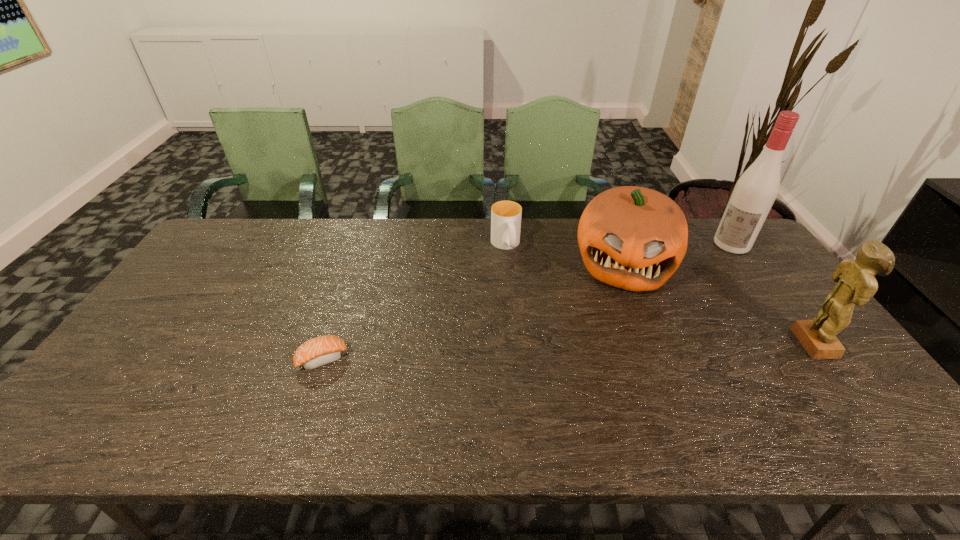
The image size is (960, 540). What are the coordinates of `cup located in the far edge section of the desktop` in the screenshot? It's located at (505, 215).

The image size is (960, 540). Identify the location of figurine positioned at the right edge. (856, 283).

This screenshot has width=960, height=540. I want to click on alcohol that is at the right edge, so click(757, 188).

Find the location of `object located in the far right corner section of the desktop`. object located in the far right corner section of the desktop is located at coordinates (757, 188).

Locate an element on the screen. Image resolution: width=960 pixels, height=540 pixels. vacant space at the far edge of the desktop is located at coordinates (538, 233).

The image size is (960, 540). What are the coordinates of `free space at the near edge of the desktop` in the screenshot? It's located at (344, 399).

Image resolution: width=960 pixels, height=540 pixels. In order to click on vacant point at the left edge in this screenshot , I will do `click(175, 340)`.

This screenshot has width=960, height=540. In order to click on vacant region at the near left corner of the desktop in this screenshot , I will do `click(132, 406)`.

Where is `free area in between the cup and the sushi`? This screenshot has height=540, width=960. free area in between the cup and the sushi is located at coordinates (414, 302).

Find the location of `empty location between the figurine and the cup`. empty location between the figurine and the cup is located at coordinates (661, 294).